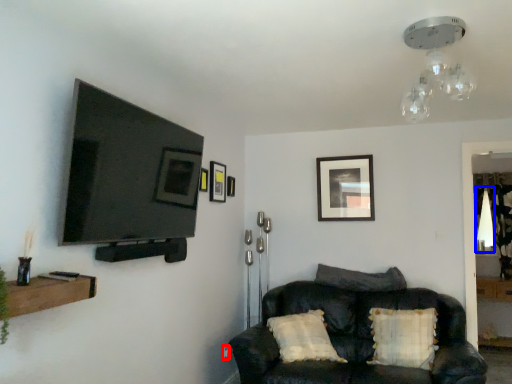
Question: Which of the following is the farthest to the observer, electric outlet (highlighted by a red box) or light fixture (highlighted by a blue box)?

Choices:
 (A) electric outlet
 (B) light fixture

Answer: (B)